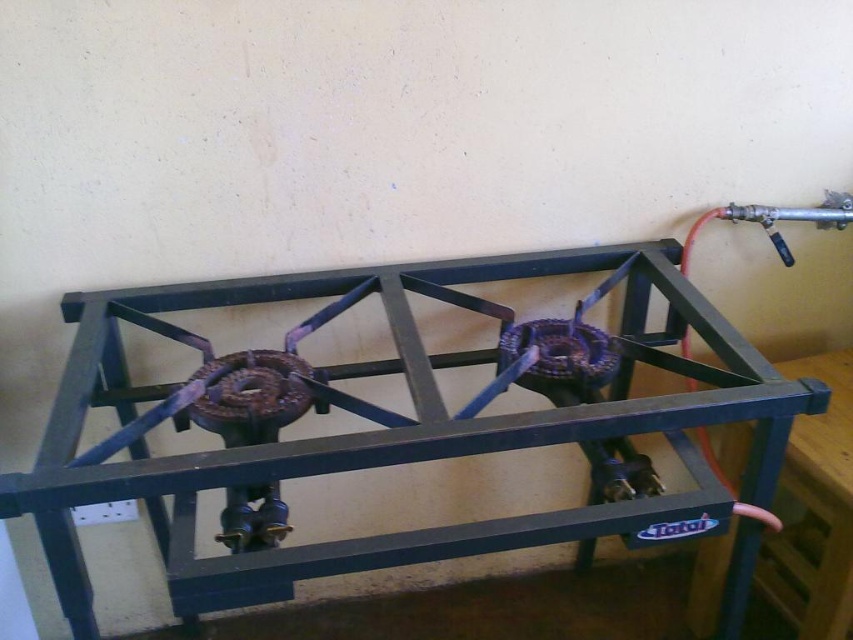
Question: Is black metal gas stove at center above metallic blue table at right?

Choices:
 (A) no
 (B) yes

Answer: (B)

Question: Which of the following is the closest to the observer?

Choices:
 (A) (838, 372)
 (B) (167, 294)

Answer: (B)

Question: Is black metal gas stove at center below metallic blue table at right?

Choices:
 (A) no
 (B) yes

Answer: (A)

Question: Can you confirm if black metal gas stove at center is bigger than metallic blue table at right?

Choices:
 (A) no
 (B) yes

Answer: (B)

Question: Which point appears farthest from the camera in this image?

Choices:
 (A) (840, 460)
 (B) (532, 540)

Answer: (A)